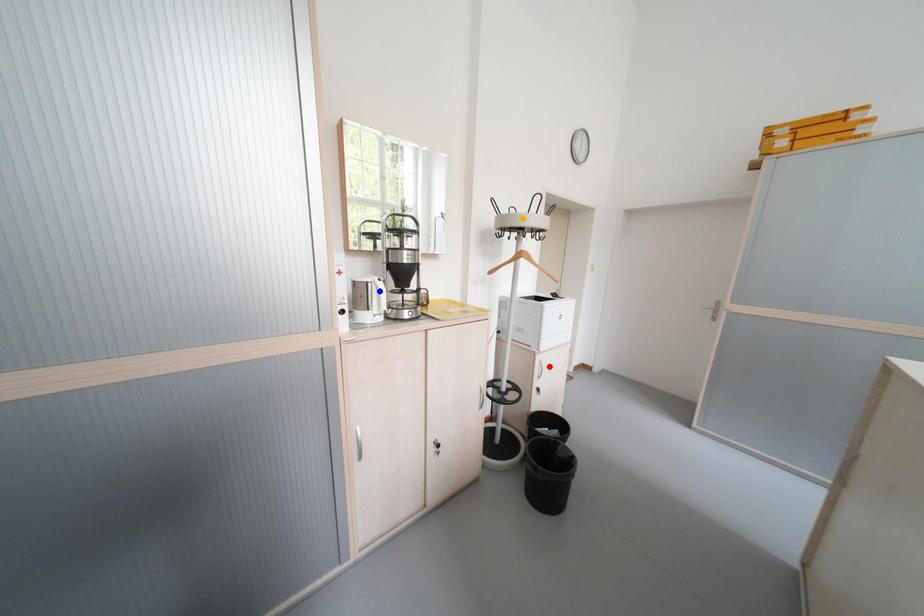
Order these from nearest to farthest:
- orange point
- blue point
- red point

blue point → orange point → red point